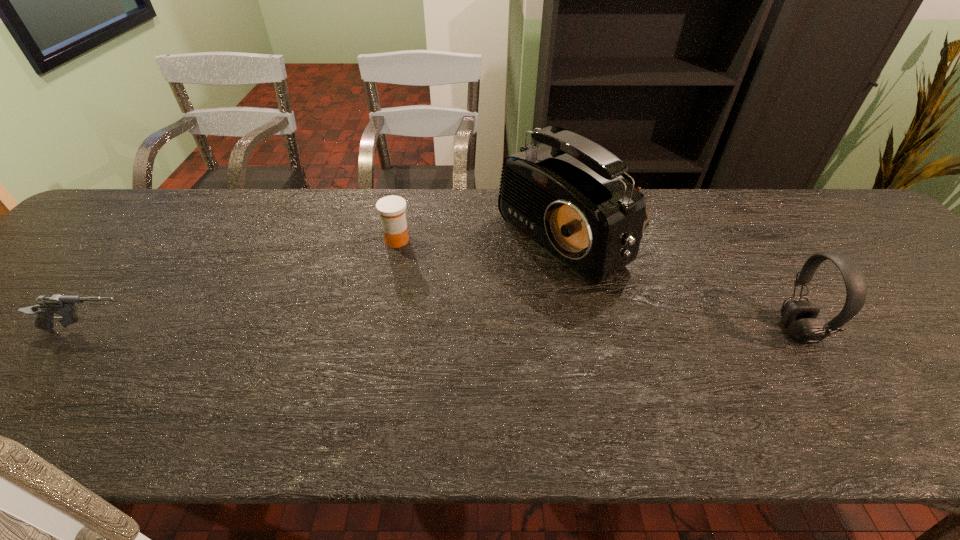
Locate an element on the screen. The width and height of the screenshot is (960, 540). free space between the leftmost object and the tallest object is located at coordinates (334, 284).

The width and height of the screenshot is (960, 540). I want to click on vacant space that's between the leftmost object and the medicine, so click(244, 286).

The width and height of the screenshot is (960, 540). I want to click on free space that is in between the medicine and the headset, so click(x=597, y=286).

Locate an element on the screen. The height and width of the screenshot is (540, 960). object that can be found as the closest to the leftmost object is located at coordinates (392, 208).

Identify which object is the closest to the medicine. Please provide its 2D coordinates. Your answer should be formatted as a tuple, i.e. [(x, y)], where the tuple contains the x and y coordinates of a point satisfying the conditions above.

[(566, 195)]